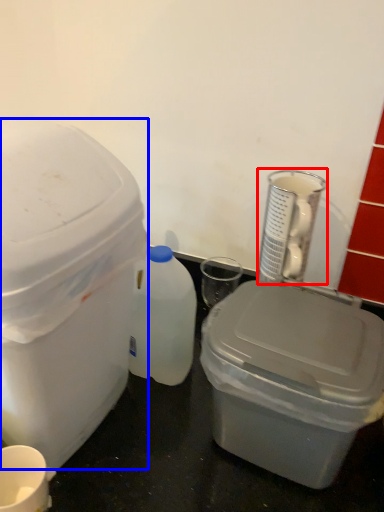
Question: Which object appears closest to the camera in this image, appliance (highlighted by a red box) or storage box (highlighted by a blue box)?

Choices:
 (A) appliance
 (B) storage box

Answer: (B)